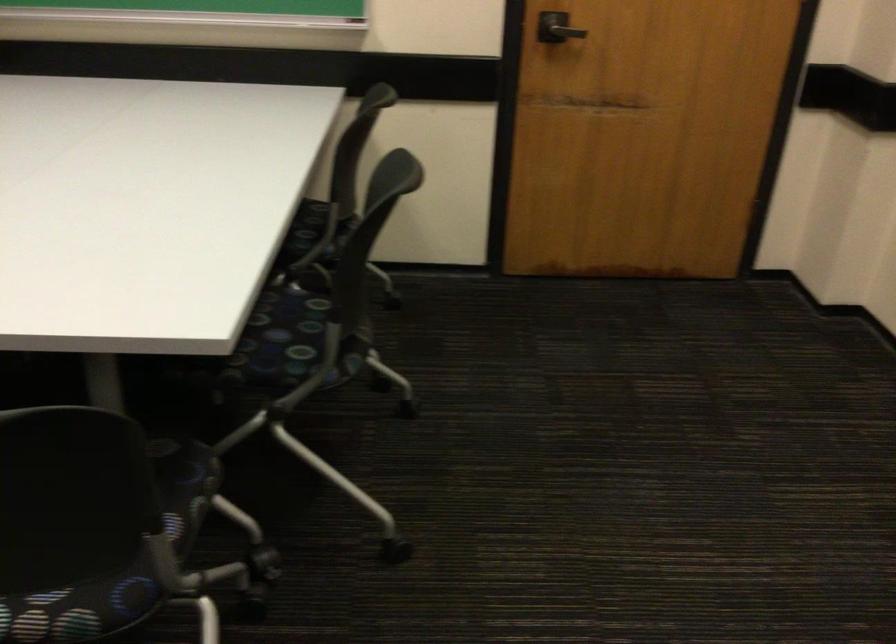
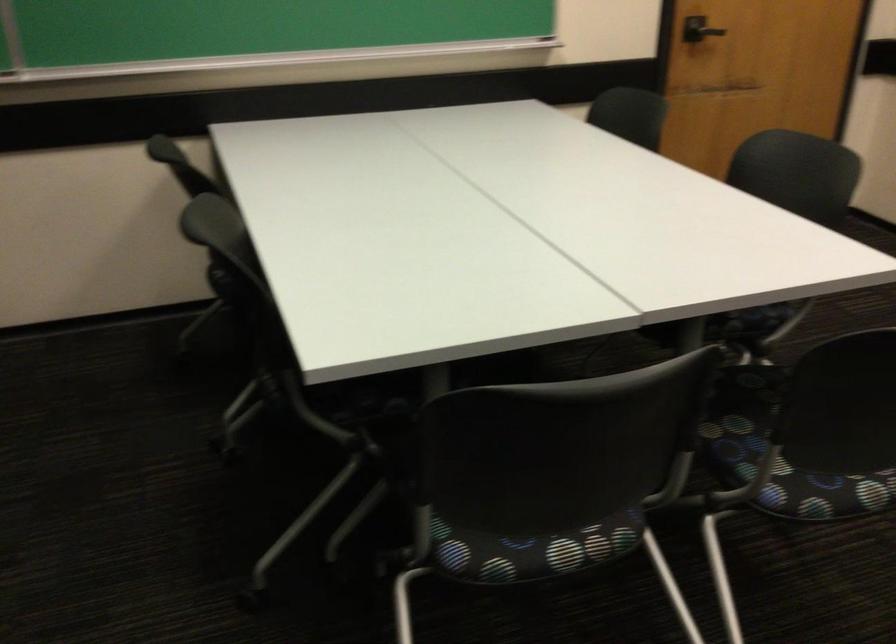
Find the pixel in the second image that matches point 229,377 in the first image.

(734, 328)